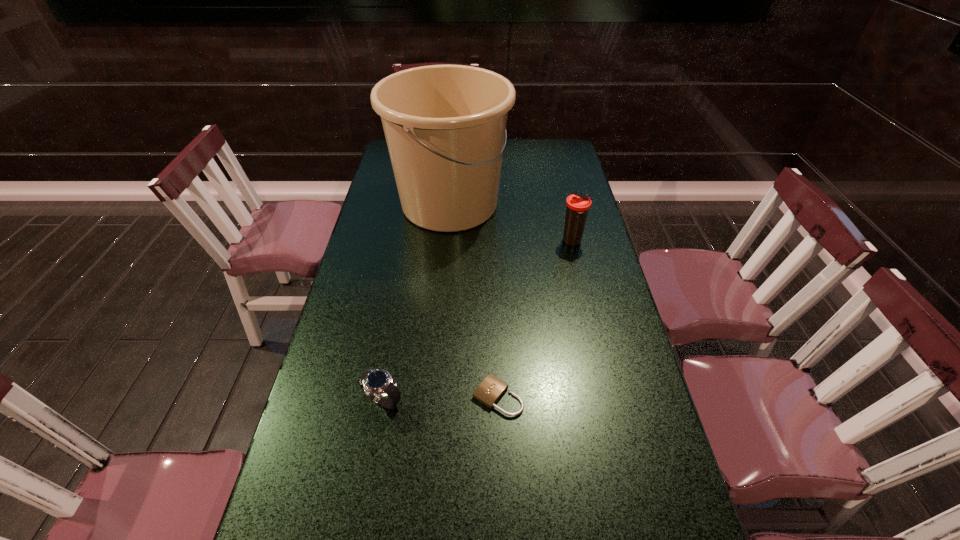
This screenshot has width=960, height=540. I want to click on the tallest object, so click(x=445, y=125).

Image resolution: width=960 pixels, height=540 pixels. Find the location of `the rightmost object`. the rightmost object is located at coordinates (578, 204).

Find the location of a particular element. thermos bottle is located at coordinates (578, 204).

Locate an element on the screen. Image resolution: width=960 pixels, height=540 pixels. watch is located at coordinates (378, 384).

The height and width of the screenshot is (540, 960). What are the coordinates of `the shortest object` in the screenshot? It's located at (490, 390).

Identify the location of vacant area situated 0.160m on the right of the bucket. (554, 204).

Identify the location of vacant space positioned 0.270m on the front of the third shortest object. (x=589, y=313).

Where is `free space located 0.160m on the back of the third tallest object`? free space located 0.160m on the back of the third tallest object is located at coordinates (395, 334).

Identify the location of free space located on the right of the shortest object. Image resolution: width=960 pixels, height=540 pixels. (608, 396).

At what (x,y) coordinates should I click in order to perform the action: click on bucket at the left edge. Please return your answer as a coordinate pair (x, y). Image resolution: width=960 pixels, height=540 pixels. Looking at the image, I should click on (445, 125).